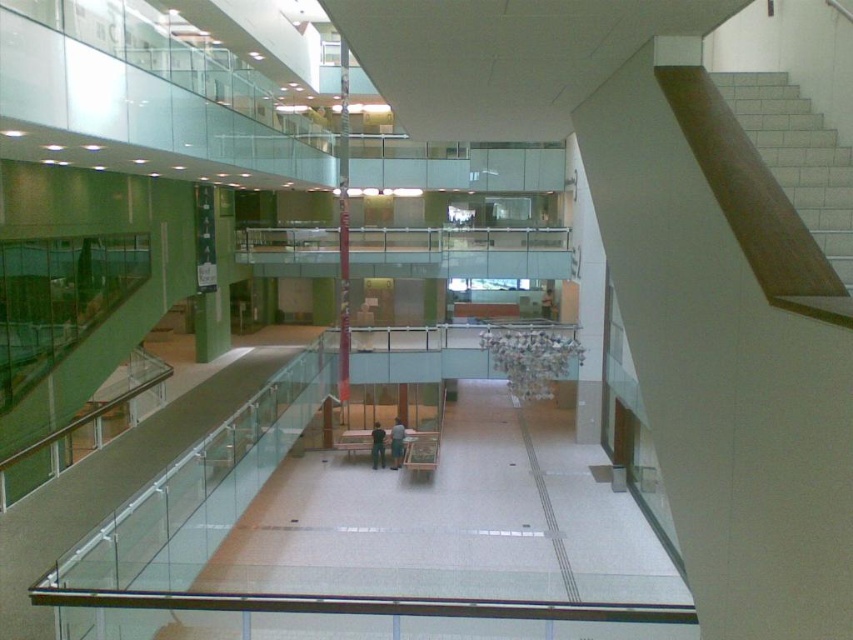
Can you confirm if clear glass balustrade at center is positioned to the left of green fabric shirt at center?

In fact, clear glass balustrade at center is to the right of green fabric shirt at center.

Which is behind, point (486, 230) or point (381, 458)?

The point (486, 230) is more distant.

Image resolution: width=853 pixels, height=640 pixels. Identify the location of clear glass balustrade at center. (460, 252).

Locate an element on the screen. This screenshot has height=640, width=853. clear glass balustrade at center is located at coordinates (460, 252).

Does clear glass balustrade at center have a larger size compared to dark blue jeans at center?

Yes.

Which is above, clear glass balustrade at center or dark blue jeans at center?

clear glass balustrade at center

Where is `clear glass balustrade at center`? clear glass balustrade at center is located at coordinates [460, 252].

Is point (811, 225) positioned after point (399, 442)?

That is False.

Measure the distance between white tile stairs at upper right and camera.

white tile stairs at upper right is 4.50 meters from camera.

Identify the location of white tile stairs at upper right. (798, 157).